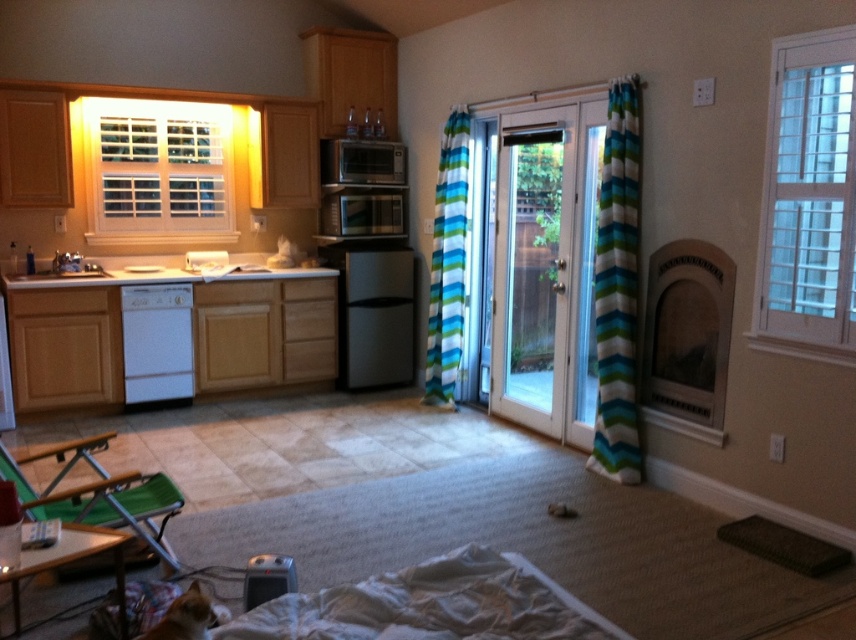
Is point (373, 360) farther from camera compared to point (446, 310)?

Yes, point (373, 360) is behind point (446, 310).

Based on the photo, measure the distance between point (395, 257) and camera.

They are 5.60 meters apart.

The width and height of the screenshot is (856, 640). I want to click on black matte mini fridge at center, so click(x=373, y=314).

Can you confirm if white textured glass door at upper right is positioned below satin silver microwave at upper center?

Yes, white textured glass door at upper right is below satin silver microwave at upper center.

In the scene shown: Who is more distant from viewer, (840, 52) or (327, 147)?

Positioned behind is point (327, 147).

What do you see at coordinates (809, 195) in the screenshot? The image size is (856, 640). I see `white textured glass door at upper right` at bounding box center [809, 195].

At what (x,y) coordinates should I click in order to perform the action: click on white textured glass door at upper right. Please return your answer as a coordinate pair (x, y). This screenshot has height=640, width=856. Looking at the image, I should click on (809, 195).

Does black matte mini fridge at center come in front of satin silver microwave at upper center?

That is False.

Which is behind, point (405, 276) or point (403, 177)?

Point (403, 177)

Locate an element on the screen. black matte mini fridge at center is located at coordinates (373, 314).